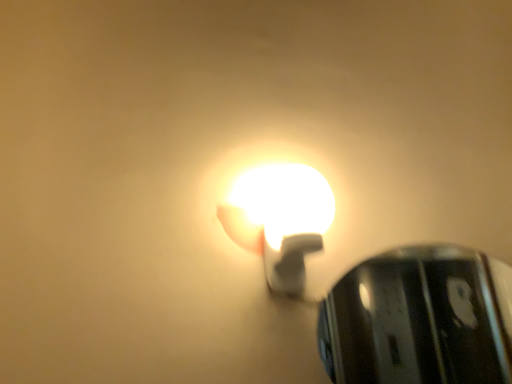
Question: Is point (258, 192) positioned closer to the camera than point (419, 306)?

Choices:
 (A) closer
 (B) farther

Answer: (A)

Question: In terms of height, does white glossy bulb at center, which is counted as the 2th lamp, starting from the right, look taller or shorter compared to glossy metallic lamp at upper center, placed as the 2th lamp when sorted from left to right?

Choices:
 (A) tall
 (B) short

Answer: (B)

Question: From the image's perspective, is white glossy bulb at center, which is counted as the 2th lamp, starting from the right, positioned above or below glossy metallic lamp at upper center, acting as the 1th lamp starting from the right?

Choices:
 (A) above
 (B) below

Answer: (A)

Question: Considering the relative positions of glossy metallic lamp at upper center, acting as the 1th lamp starting from the right, and white glossy bulb at center, arranged as the 1th lamp when viewed from the left, in the image provided, is glossy metallic lamp at upper center, acting as the 1th lamp starting from the right, to the left or to the right of white glossy bulb at center, arranged as the 1th lamp when viewed from the left,?

Choices:
 (A) left
 (B) right

Answer: (B)

Question: In the image, is glossy metallic lamp at upper center, placed as the 2th lamp when sorted from left to right, positioned in front of or behind white glossy bulb at center, arranged as the 1th lamp when viewed from the left?

Choices:
 (A) behind
 (B) front

Answer: (A)

Question: Is point (329, 372) positioned closer to the camera than point (276, 223)?

Choices:
 (A) farther
 (B) closer

Answer: (A)

Question: Do you think glossy metallic lamp at upper center, acting as the 1th lamp starting from the right, is within white glossy bulb at center, which is counted as the 2th lamp, starting from the right, or outside of it?

Choices:
 (A) inside
 (B) outside

Answer: (B)